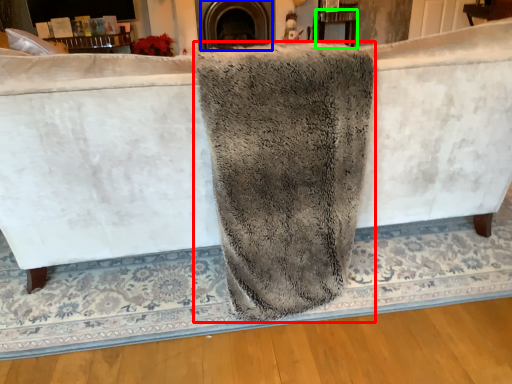
Question: Which object is positioned farthest from bath towel (highlighted by a red box)? Select from fireplace (highlighted by a blue box) and table (highlighted by a green box).

Choices:
 (A) fireplace
 (B) table

Answer: (B)